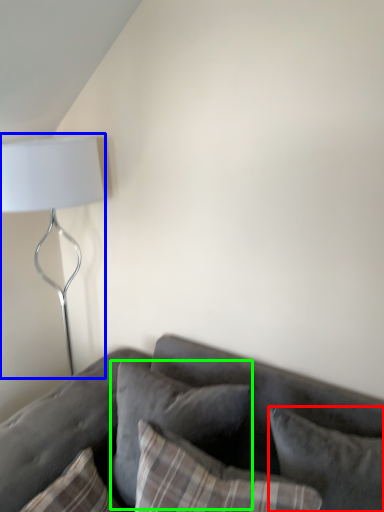
Question: Considering the real-world distances, which object is closest to pillow (highlighted by a red box)? lamp (highlighted by a blue box) or pillow (highlighted by a green box).

Choices:
 (A) lamp
 (B) pillow

Answer: (B)